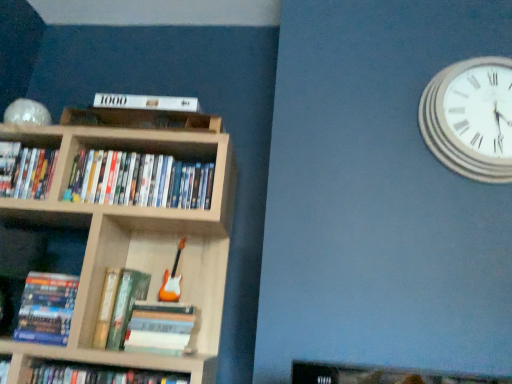
The width and height of the screenshot is (512, 384). Find the location of `matte cardboard book at lower left`. matte cardboard book at lower left is located at coordinates (37, 252).

Measure the distance between wooden bookcase at center and camera.

wooden bookcase at center is 3.84 feet from camera.

Where is `hardcover book at lower left, the 2th book from the left`? Image resolution: width=512 pixels, height=384 pixels. hardcover book at lower left, the 2th book from the left is located at coordinates (46, 308).

Image resolution: width=512 pixels, height=384 pixels. Describe the element at coordinates (118, 306) in the screenshot. I see `hardcover book at center, the 3th book from the right` at that location.

Image resolution: width=512 pixels, height=384 pixels. Identify the location of matte cardboard book at lower left. (37, 252).

Would you say hardcover book at lower left, the fourth book in the right-to-left sequence, is to the left or to the right of white wooden clock at upper right in the picture?

hardcover book at lower left, the fourth book in the right-to-left sequence, is to the left of white wooden clock at upper right.

Considering the positions of point (69, 312) and point (507, 169), is point (69, 312) closer or farther from the camera than point (507, 169)?

Point (69, 312) is positioned farther from the camera compared to point (507, 169).

At what (x,y) coordinates should I click in order to perform the action: click on wall clock above the hardcover book at lower left, the fourth book in the right-to-left sequence (from a real-world perspective). Please return your answer as a coordinate pair (x, y). The width and height of the screenshot is (512, 384). Looking at the image, I should click on (471, 118).

From the image's perspective, relative to white wooden clock at upper right, is hardcover book at lower left, the 2th book from the left, above or below?

From the image's perspective, hardcover book at lower left, the 2th book from the left, appears below white wooden clock at upper right.

Can you confirm if white wooden clock at upper right is positioned to the right of wooden bookcase at center?

Indeed, white wooden clock at upper right is positioned on the right side of wooden bookcase at center.

In terms of height, does white wooden clock at upper right look taller or shorter compared to wooden bookcase at center?

In the image, white wooden clock at upper right appears to be shorter than wooden bookcase at center.

Could you tell me if white wooden clock at upper right is turned towards wooden bookcase at center?

No, white wooden clock at upper right is not oriented towards wooden bookcase at center.

Is the surface of white wooden clock at upper right in direct contact with wooden bookcase at center?

No, white wooden clock at upper right is not making contact with wooden bookcase at center.

Is hardcover book at lower center, marked as the fifth book in a left-to-right arrangement, a part of wooden bookcase at center?

Yes, wooden bookcase at center is surrounding hardcover book at lower center, marked as the fifth book in a left-to-right arrangement.

Who is taller, wooden bookcase at center or hardcover book at lower center, marked as the fifth book in a left-to-right arrangement?

wooden bookcase at center is taller.

Which object is positioned more to the left, wooden bookcase at center or hardcover book at lower center, marked as the fifth book in a left-to-right arrangement?

wooden bookcase at center.

Considering the points (105, 258) and (169, 338), which point is in front, point (105, 258) or point (169, 338)?

The point (169, 338) is in front.

Is matte plastic dvds at center, which ranks as the 2th book in right-to-left order, located outside white wooden clock at upper right?

Yes.

Does matte plastic dvds at center, which ranks as the 2th book in right-to-left order, appear on the right side of white wooden clock at upper right?

No, matte plastic dvds at center, which ranks as the 2th book in right-to-left order, is not to the right of white wooden clock at upper right.

Is point (158, 158) farther from viewer compared to point (438, 89)?

Yes, point (158, 158) is behind point (438, 89).

Can you confirm if matte plastic dvds at center, which ranks as the 2th book in right-to-left order, is wider than white wooden clock at upper right?

Indeed, matte plastic dvds at center, which ranks as the 2th book in right-to-left order, has a greater width compared to white wooden clock at upper right.

From a real-world perspective, between matte black book at upper left, arranged as the first book when viewed from the left, and hardcover book at center, which ranks as the third book in left-to-right order, who is vertically higher?

In real-world perspective, matte black book at upper left, arranged as the first book when viewed from the left, is above.

Can you confirm if matte black book at upper left, acting as the fifth book starting from the right, is taller than hardcover book at center, the 3th book from the right?

Incorrect, the height of matte black book at upper left, acting as the fifth book starting from the right, is not larger of that of hardcover book at center, the 3th book from the right.

You are a GUI agent. You are given a task and a screenshot of the screen. Output one action in this format:
    pyautogui.click(x=<x>, y=<y>)
    Task: Click on the book that is the 3rd object located in front of the matte black book at upper left, arranged as the first book when viewed from the left
    
    Given the screenshot: What is the action you would take?
    pyautogui.click(x=118, y=306)

Is matte black book at upper left, arranged as the first book when viewed from the left, not inside hardcover book at center, which ranks as the third book in left-to-right order?

matte black book at upper left, arranged as the first book when viewed from the left, lies outside hardcover book at center, which ranks as the third book in left-to-right order,'s area.

Would you consider white wooden clock at upper right to be distant from matte plastic dvds at center, which ranks as the 2th book in right-to-left order?

white wooden clock at upper right is near matte plastic dvds at center, which ranks as the 2th book in right-to-left order, not far away.

Is matte plastic dvds at center, acting as the fourth book starting from the left, surrounded by white wooden clock at upper right?

No.

Which of these two, white wooden clock at upper right or matte plastic dvds at center, acting as the fourth book starting from the left, is smaller?

Smaller between the two is white wooden clock at upper right.

Where is `wall clock on the right of matte plastic dvds at center, which ranks as the 2th book in right-to-left order`? The height and width of the screenshot is (384, 512). wall clock on the right of matte plastic dvds at center, which ranks as the 2th book in right-to-left order is located at coordinates (471, 118).

Looking at this image, is hardcover book at lower left, the fourth book in the right-to-left sequence, outside of matte black book at upper left, acting as the fifth book starting from the right?

Yes, hardcover book at lower left, the fourth book in the right-to-left sequence, is not within matte black book at upper left, acting as the fifth book starting from the right.

From a real-world perspective, is hardcover book at lower left, the fourth book in the right-to-left sequence, positioned under matte black book at upper left, arranged as the first book when viewed from the left, based on gravity?

Yes, from a real-world perspective, hardcover book at lower left, the fourth book in the right-to-left sequence, is under matte black book at upper left, arranged as the first book when viewed from the left.

Does hardcover book at lower left, the 2th book from the left, have a lesser width compared to matte black book at upper left, acting as the fifth book starting from the right?

Correct, the width of hardcover book at lower left, the 2th book from the left, is less than that of matte black book at upper left, acting as the fifth book starting from the right.

In the scene shown: Can you tell me how much hardcover book at lower left, the 2th book from the left, and matte black book at upper left, arranged as the first book when viewed from the left, differ in facing direction?

hardcover book at lower left, the 2th book from the left, and matte black book at upper left, arranged as the first book when viewed from the left, are facing 0.00156 degrees away from each other.

Locate an element on the screen. The image size is (512, 384). book that is the 4th one below the white wooden clock at upper right (from a real-world perspective) is located at coordinates (46, 308).

Where is `wall clock above the wooden bookcase at center (from the image's perspective)`? wall clock above the wooden bookcase at center (from the image's perspective) is located at coordinates (471, 118).

Looking at this image, which object lies further to the anchor point hardcover book at center, which ranks as the third book in left-to-right order, hardcover book at lower left, the fourth book in the right-to-left sequence, or white wooden clock at upper right?

white wooden clock at upper right lies further to hardcover book at center, which ranks as the third book in left-to-right order, than the other object.

Estimate the real-world distances between objects in this image. Which object is closer to matte black book at upper left, arranged as the first book when viewed from the left, matte plastic dvds at center, which ranks as the 2th book in right-to-left order, or matte cardboard book at lower left?

matte cardboard book at lower left is positioned closer to the anchor matte black book at upper left, arranged as the first book when viewed from the left.

From the image, which object appears to be nearer to hardcover book at lower center, which ranks as the first book in right-to-left order, matte cardboard book at lower left or matte black book at upper left, arranged as the first book when viewed from the left?

The object closer to hardcover book at lower center, which ranks as the first book in right-to-left order, is matte cardboard book at lower left.

Considering their positions, is hardcover book at center, which ranks as the third book in left-to-right order, positioned closer to matte black book at upper left, arranged as the first book when viewed from the left, than matte cardboard book at lower left?

matte cardboard book at lower left is closer to matte black book at upper left, arranged as the first book when viewed from the left.

Based on their spatial positions, is hardcover book at center, which ranks as the third book in left-to-right order, or matte black book at upper left, arranged as the first book when viewed from the left, closer to matte cardboard book at lower left?

The object closer to matte cardboard book at lower left is matte black book at upper left, arranged as the first book when viewed from the left.

Based on their spatial positions, is hardcover book at lower center, marked as the fifth book in a left-to-right arrangement, or matte plastic dvds at center, which ranks as the 2th book in right-to-left order, closer to matte cardboard book at lower left?

matte plastic dvds at center, which ranks as the 2th book in right-to-left order.

In the scene shown: Which object lies further to the anchor point white wooden clock at upper right, wooden bookcase at center or matte black book at upper left, acting as the fifth book starting from the right?

Among the two, matte black book at upper left, acting as the fifth book starting from the right, is located further to white wooden clock at upper right.

Considering their positions, is matte cardboard book at lower left positioned further to white wooden clock at upper right than wooden bookcase at center?

The object further to white wooden clock at upper right is matte cardboard book at lower left.

I want to click on bookcase between matte black book at upper left, arranged as the first book when viewed from the left, and matte cardboard book at lower left, in the vertical direction, so pos(135,243).

In order to click on shelf between matte black book at upper left, arranged as the first book when viewed from the left, and hardcover book at lower center, marked as the fifth book in a left-to-right arrangement, in the horizontal direction in this screenshot , I will do `click(37, 252)`.

Where is `shelf located between matte black book at upper left, arranged as the first book when viewed from the left, and white wooden clock at upper right in the left-right direction`? The width and height of the screenshot is (512, 384). shelf located between matte black book at upper left, arranged as the first book when viewed from the left, and white wooden clock at upper right in the left-right direction is located at coordinates tap(37, 252).

Identify the location of book between matte black book at upper left, arranged as the first book when viewed from the left, and hardcover book at lower left, the fourth book in the right-to-left sequence, from top to bottom. (139, 180).